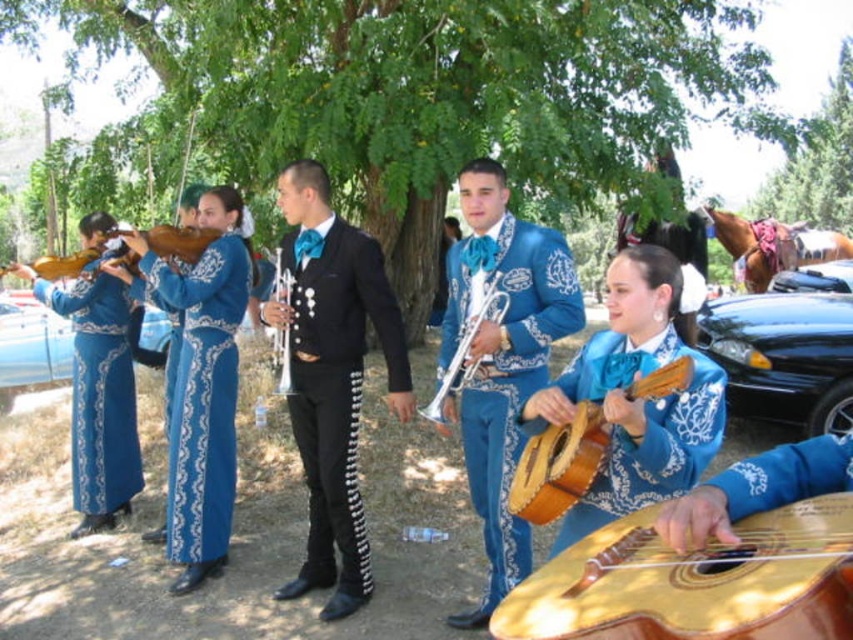
Question: Which point is farther to the camera?

Choices:
 (A) (798, 216)
 (B) (624, 547)
 (C) (15, 333)

Answer: (A)

Question: Which of the following is the farthest from the observer?

Choices:
 (A) (207, 420)
 (B) (123, 394)

Answer: (B)

Question: Is shiny black suit at center in front of matte blue suit at center?

Choices:
 (A) no
 (B) yes

Answer: (A)

Question: Can you confirm if shiny black suit at center is bigger than green leafy tree at upper center?

Choices:
 (A) no
 (B) yes

Answer: (A)

Question: Which of these objects is positioned closest to the blue metallic car at lower left?

Choices:
 (A) wooden acoustic guitar at center
 (B) matte blue suit at center
 (C) shiny black suit at center

Answer: (C)

Question: Where is green leafy tree at upper center located in relation to wooden acoustic guitar at center in the image?

Choices:
 (A) above
 (B) below

Answer: (A)